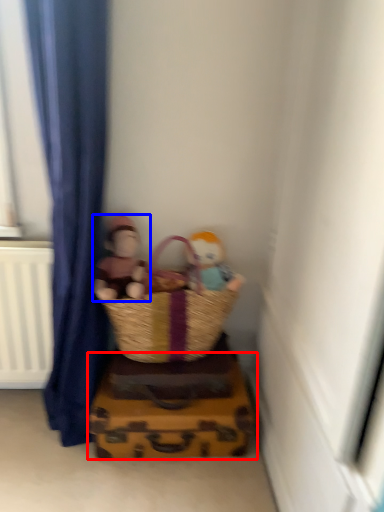
Question: Among these objects, which one is farthest to the camera, crate (highlighted by a red box) or person (highlighted by a blue box)?

Choices:
 (A) crate
 (B) person

Answer: (A)